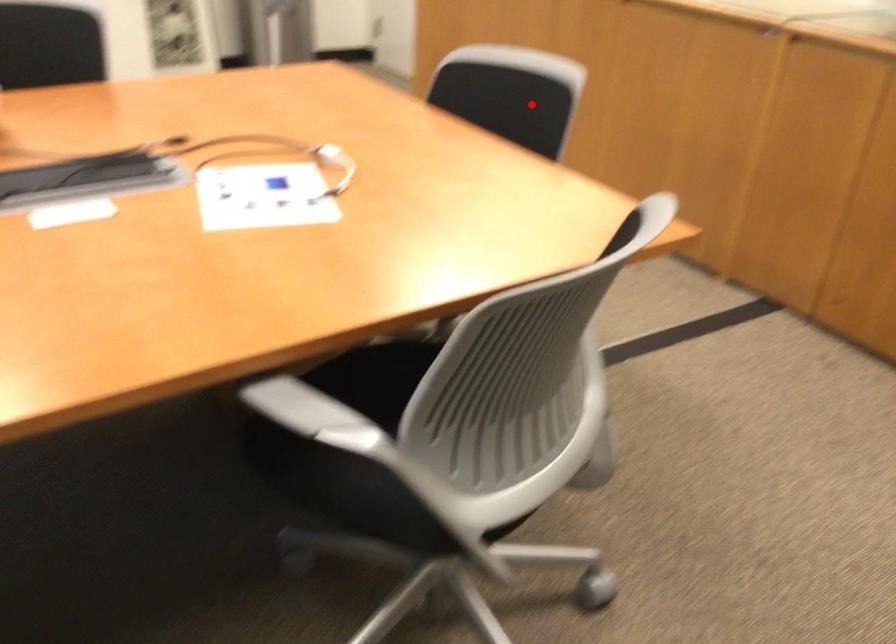
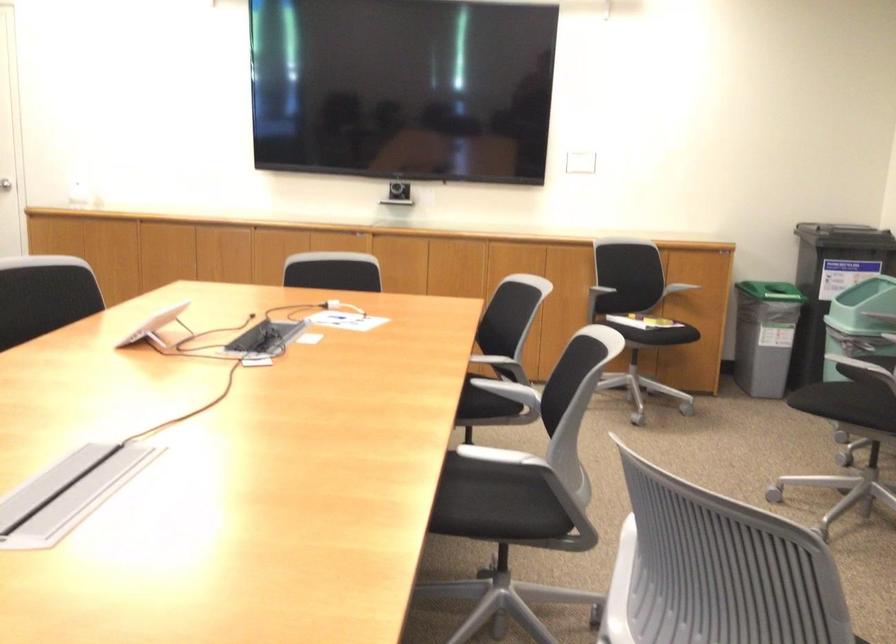
Question: A red point is marked in image1. In image2, is the corresponding 3D point closer to the camera or farther? Reply with the corresponding letter.

Choices:
 (A) The corresponding 3D point is closer.
 (B) The corresponding 3D point is farther.

Answer: (B)